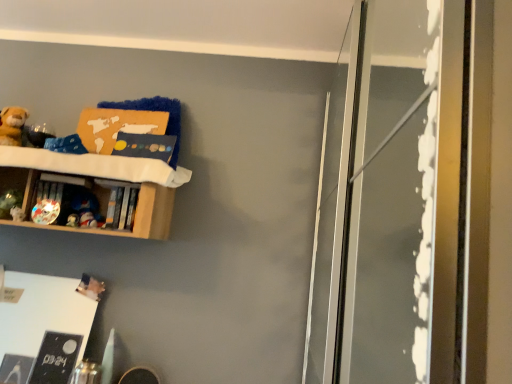
Question: Is transparent glass screen door at right wider or thinner than matte plastic toy at left, arranged as the third toy when ordered from the bottom?

Choices:
 (A) thin
 (B) wide

Answer: (B)

Question: From the image's perspective, is transparent glass screen door at right positioned above or below matte plastic toy at left, the fourth toy in the top-to-bottom sequence?

Choices:
 (A) below
 (B) above

Answer: (A)

Question: Which is nearer to the matte plastic toy at center-left, the fourth toy ordered from the bottom?

Choices:
 (A) white matte board at lower left
 (B) matte plastic toy at upper left, acting as the sixth toy starting from the top
 (C) soft plush bear at upper left, the sixth toy when ordered from bottom to top
 (D) shiny metallic toy at left, arranged as the 5th toy when ordered from the bottom
 (E) matte plastic toy at left, positioned as the fifth toy in top-to-bottom order

Answer: (B)

Question: Estimate the real-world distances between objects in this image. Which object is farther from the matte plastic toy at center-left, the 3th toy from the top?

Choices:
 (A) matte plastic toy at left, marked as the second toy in a bottom-to-top arrangement
 (B) white matte board at lower left
 (C) shiny metallic toy at left, the 2th toy when ordered from top to bottom
 (D) soft plush bear at upper left, which ranks as the 1th toy in top-to-bottom order
 (E) wooden shelf at upper left

Answer: (B)